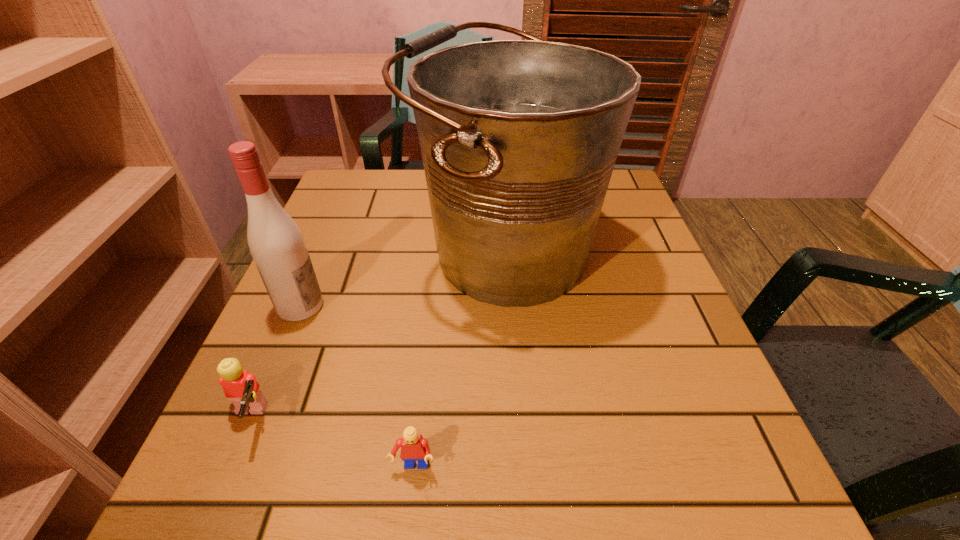
You are a GUI agent. You are given a task and a screenshot of the screen. Output one action in this format:
    pyautogui.click(x=<x>, y=<y>)
    Task: Click on the tallest object
    The image size is (960, 540).
    Given the screenshot: What is the action you would take?
    pyautogui.click(x=519, y=138)

Locate an element on the screen. alcohol is located at coordinates (276, 243).

Identify the location of the third farthest object. Image resolution: width=960 pixels, height=540 pixels. (240, 386).

Identify the location of the taller Lego. The image size is (960, 540). (240, 386).

Find the location of a particular element. the right Lego is located at coordinates (414, 447).

What are the coordinates of `the shortest object` in the screenshot? It's located at (414, 447).

Image resolution: width=960 pixels, height=540 pixels. Find the location of `free space located on the front of the bucket`. free space located on the front of the bucket is located at coordinates (514, 382).

Where is `vacant space located 0.180m on the label of the alcohol`? The width and height of the screenshot is (960, 540). vacant space located 0.180m on the label of the alcohol is located at coordinates click(419, 306).

This screenshot has height=540, width=960. What are the coordinates of `free space located in front of the taller Lego with the accessory visible` in the screenshot? It's located at (331, 420).

This screenshot has width=960, height=540. In order to click on blank space located 0.060m on the front-facing side of the nearest object in this screenshot , I will do `click(406, 526)`.